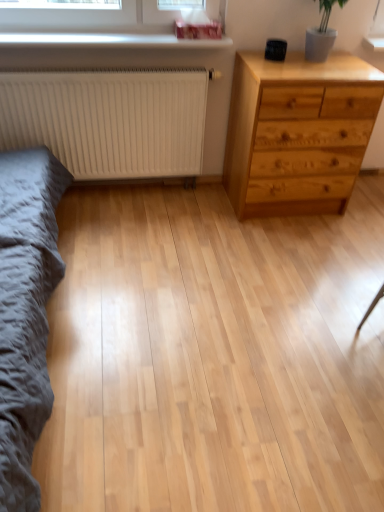
Where is `free location in front of white matte radiator at left`? The width and height of the screenshot is (384, 512). free location in front of white matte radiator at left is located at coordinates (129, 251).